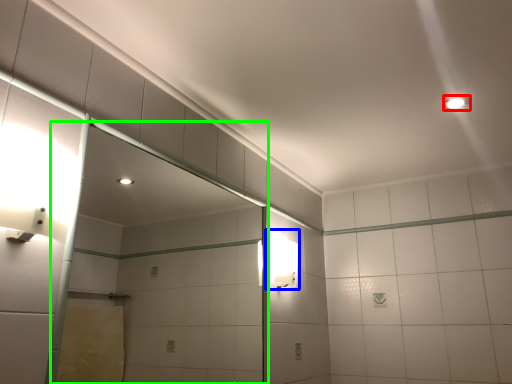
Question: Which object is the farthest from light fixture (highlighted by a red box)? Choose among these: light fixture (highlighted by a blue box) or glass door (highlighted by a green box).

Choices:
 (A) light fixture
 (B) glass door

Answer: (B)